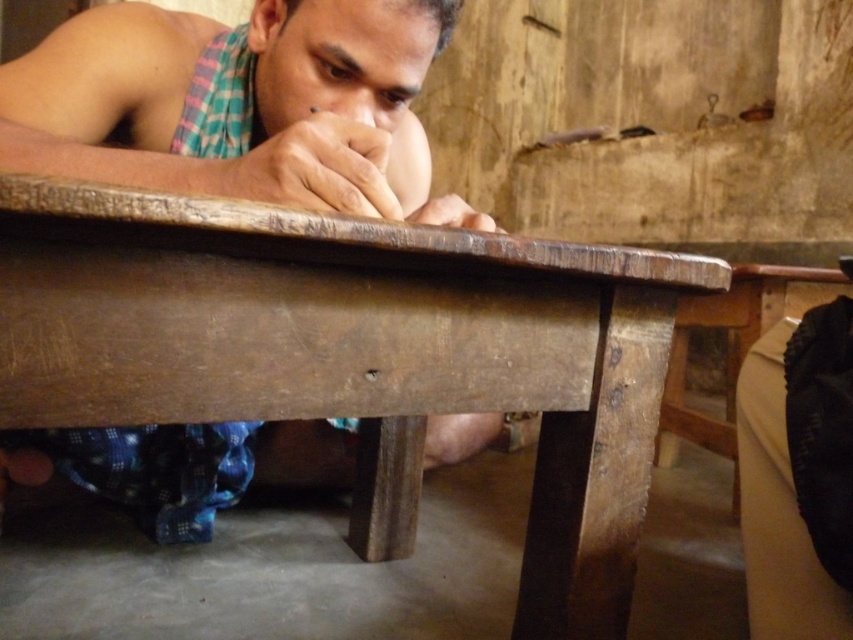
Is rough wooden table at center wider than matte wooden hand at center?

Indeed, rough wooden table at center has a greater width compared to matte wooden hand at center.

Between rough wooden table at center and matte wooden hand at center, which one has less height?

matte wooden hand at center

Is point (86, 221) positioned behind point (355, 144)?

No, (86, 221) is in front of (355, 144).

I want to click on rough wooden table at center, so click(357, 355).

Does rough wooden table at center come in front of wooden table at center?

Yes, it is in front of wooden table at center.

In order to click on rough wooden table at center in this screenshot , I will do `click(357, 355)`.

Does black fabric bag at lower right lie behind matte brown finger at center?

Yes, black fabric bag at lower right is further from the viewer.

Is point (733, 307) behind point (456, 200)?

Yes.

Where is `black fabric bag at lower right`? The height and width of the screenshot is (640, 853). black fabric bag at lower right is located at coordinates pos(734,348).